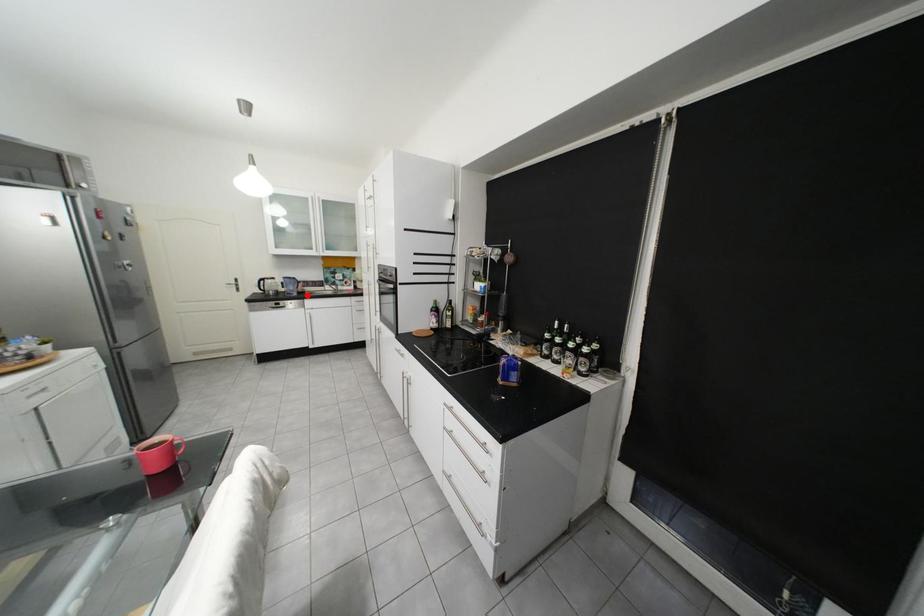
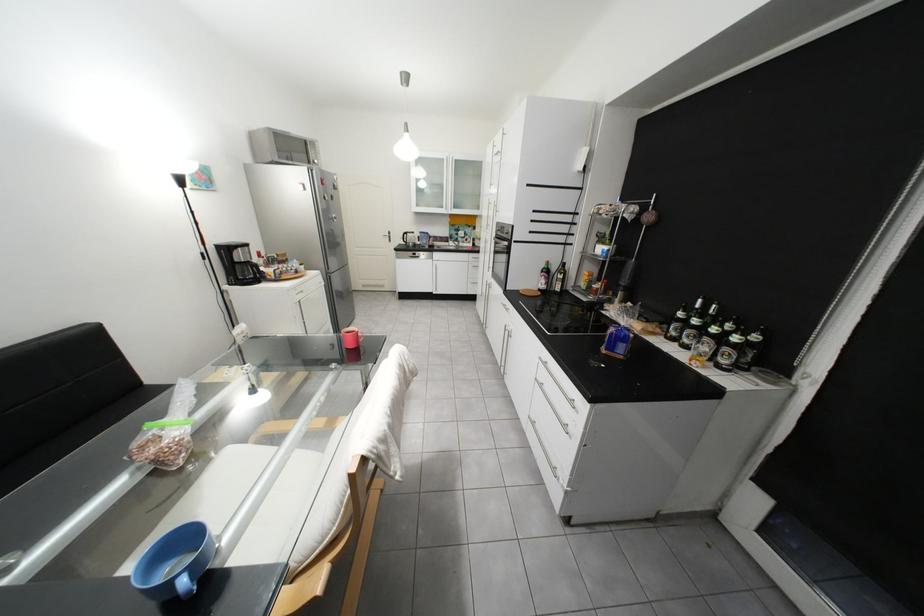
In the second image, find the point that corresponds to the highlighted location in the first image.

(439, 248)